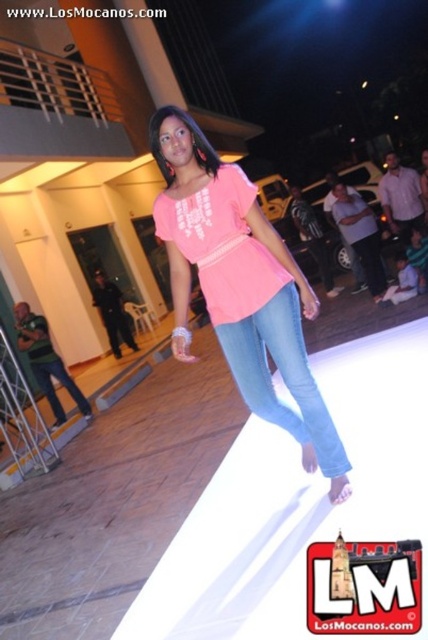
Locate an element on the screen. The image size is (428, 640). pink matte t-shirt at center is located at coordinates (240, 285).

Is pink matte t-shirt at center to the right of jeans at center from the viewer's perspective?

In fact, pink matte t-shirt at center is to the left of jeans at center.

Find the location of a particular element. pink matte t-shirt at center is located at coordinates (240, 285).